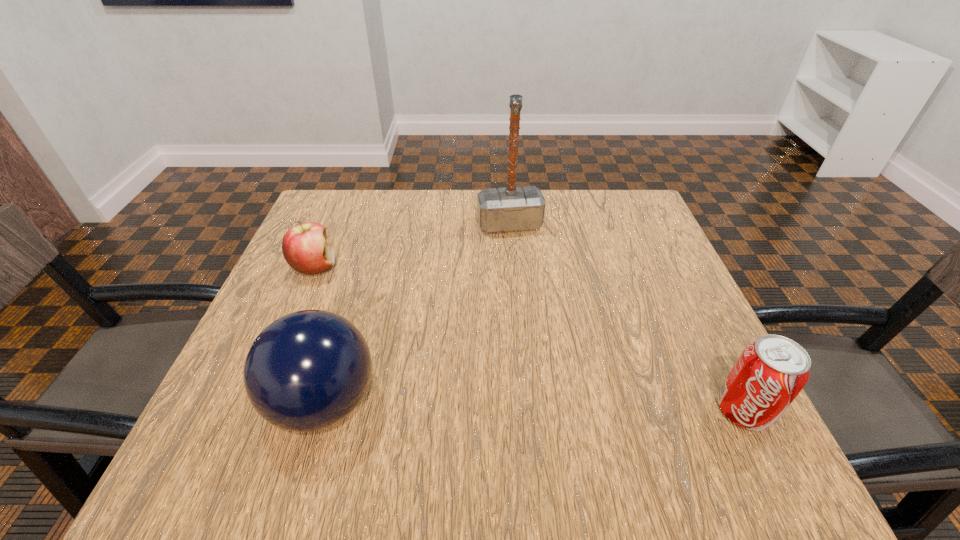
Identify which object is the nearest to the third nearest object. Please provide its 2D coordinates. Your answer should be formatted as a tuple, i.e. [(x, y)], where the tuple contains the x and y coordinates of a point satisfying the conditions above.

[(308, 370)]

In order to click on free location that satisfies the following two spatial constraints: 1. on the back side of the hammer; 2. on the right side of the apple in this screenshot , I will do `click(333, 225)`.